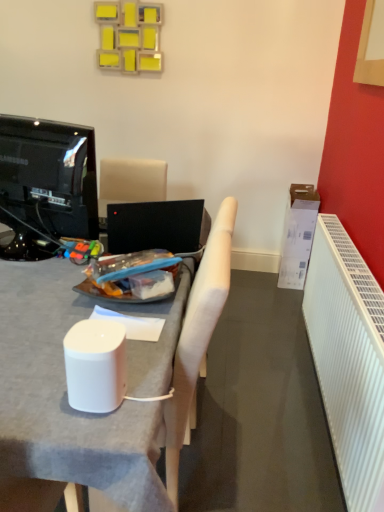
Question: Visually, is white fabric chair at center positioned to the left or to the right of white ribbed radiator at right?

Choices:
 (A) right
 (B) left

Answer: (B)

Question: Looking at their shapes, would you say white fabric chair at center is wider or thinner than white ribbed radiator at right?

Choices:
 (A) thin
 (B) wide

Answer: (B)

Question: Which object is positioned farthest from the white fabric chair at center?

Choices:
 (A) white matte desk at center
 (B) white cardboard box at right
 (C) black glossy television at left
 (D) white ribbed radiator at right

Answer: (B)

Question: Considering the real-world distances, which object is closest to the black glossy television at left?

Choices:
 (A) white matte desk at center
 (B) white ribbed radiator at right
 (C) white cardboard box at right
 (D) white fabric chair at center

Answer: (A)